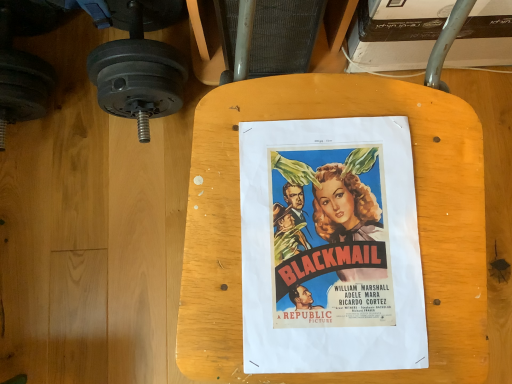
The height and width of the screenshot is (384, 512). Find the location of `matte black dumbbell at left`. matte black dumbbell at left is located at coordinates (138, 75).

Image resolution: width=512 pixels, height=384 pixels. Identify the location of wooden table at center. (239, 213).

In order to click on matte black dumbbell at left in this screenshot , I will do `click(138, 75)`.

Find the location of `poster on the right of matte black dumbbell at left`. poster on the right of matte black dumbbell at left is located at coordinates (330, 247).

Is point (138, 34) closer or farther from the camera than point (389, 365)?

Point (138, 34) is positioned farther from the camera compared to point (389, 365).

Considering the sizes of objects matte black dumbbell at left and matte paper poster at center in the image provided, who is smaller, matte black dumbbell at left or matte paper poster at center?

With smaller size is matte paper poster at center.

Which object is more forward, matte black dumbbell at left or matte paper poster at center?

Positioned in front is matte paper poster at center.

Consider the image. Is matte black dumbbell at left to the left of wooden table at center from the viewer's perspective?

Yes.

Is matte black dumbbell at left taller than wooden table at center?

No, matte black dumbbell at left is not taller than wooden table at center.

In terms of size, does matte black dumbbell at left appear bigger or smaller than wooden table at center?

In the image, matte black dumbbell at left appears to be smaller than wooden table at center.

How much distance is there between wooden table at center and matte paper poster at center?

wooden table at center and matte paper poster at center are 4.87 centimeters apart from each other.

Do you think wooden table at center is within matte paper poster at center, or outside of it?

wooden table at center cannot be found inside matte paper poster at center.

Based on the photo, considering their positions, is wooden table at center located in front of or behind matte paper poster at center?

Clearly, wooden table at center is in front of matte paper poster at center.

Who is shorter, wooden table at center or matte paper poster at center?

matte paper poster at center.

Is the position of matte paper poster at center more distant than that of wooden table at center?

Yes.

From the picture: How distant is matte paper poster at center from wooden table at center?

4.87 centimeters.

Looking at this image, is matte paper poster at center next to wooden table at center?

Absolutely, matte paper poster at center is next to and touching wooden table at center.

Is there a large distance between matte paper poster at center and matte black dumbbell at left?

That's not correct — matte paper poster at center is a little close to matte black dumbbell at left.

Between matte paper poster at center and matte black dumbbell at left, which one has more height?

matte black dumbbell at left.

Is matte paper poster at center turned away from matte black dumbbell at left?

matte paper poster at center is not turned away from matte black dumbbell at left.

Does matte paper poster at center have a lesser width compared to matte black dumbbell at left?

Yes, matte paper poster at center is thinner than matte black dumbbell at left.

Which is behind, point (417, 89) or point (165, 76)?

The point (165, 76) is farther from the camera.

Between wooden table at center and matte black dumbbell at left, which one has larger size?

wooden table at center.

From the image's perspective, which one is positioned higher, wooden table at center or matte black dumbbell at left?

From the image's view, matte black dumbbell at left is above.

Is wooden table at center not near matte black dumbbell at left?

No, wooden table at center is in close proximity to matte black dumbbell at left.

This screenshot has height=384, width=512. What are the coordinates of `dumbbell on the left side of matte paper poster at center` in the screenshot? It's located at (138, 75).

Locate an element on the screen. The image size is (512, 384). table that appears on the right of matte black dumbbell at left is located at coordinates (239, 213).

Consider the image. Looking at the image, which one is located closer to matte paper poster at center, wooden table at center or matte black dumbbell at left?

wooden table at center lies closer to matte paper poster at center than the other object.

From the image, which object appears to be nearer to matte black dumbbell at left, wooden table at center or matte paper poster at center?

Among the two, wooden table at center is located nearer to matte black dumbbell at left.

Considering their positions, is matte paper poster at center positioned further to wooden table at center than matte black dumbbell at left?

matte black dumbbell at left.

When comparing their distances from wooden table at center, does matte black dumbbell at left or matte paper poster at center seem closer?

matte paper poster at center.

Based on the photo, from the image, which object appears to be farther from matte black dumbbell at left, matte paper poster at center or wooden table at center?

matte paper poster at center.

Which object lies further to the anchor point matte paper poster at center, matte black dumbbell at left or wooden table at center?

matte black dumbbell at left lies further to matte paper poster at center than the other object.

In order to click on poster between wooden table at center and matte black dumbbell at left along the z-axis in this screenshot , I will do `click(330, 247)`.